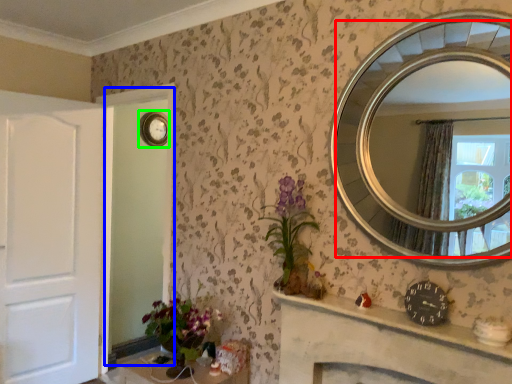
Question: Which is farther away from mirror (highlighted by a red box)? glass door (highlighted by a blue box) or clock (highlighted by a green box)?

Choices:
 (A) glass door
 (B) clock

Answer: (A)